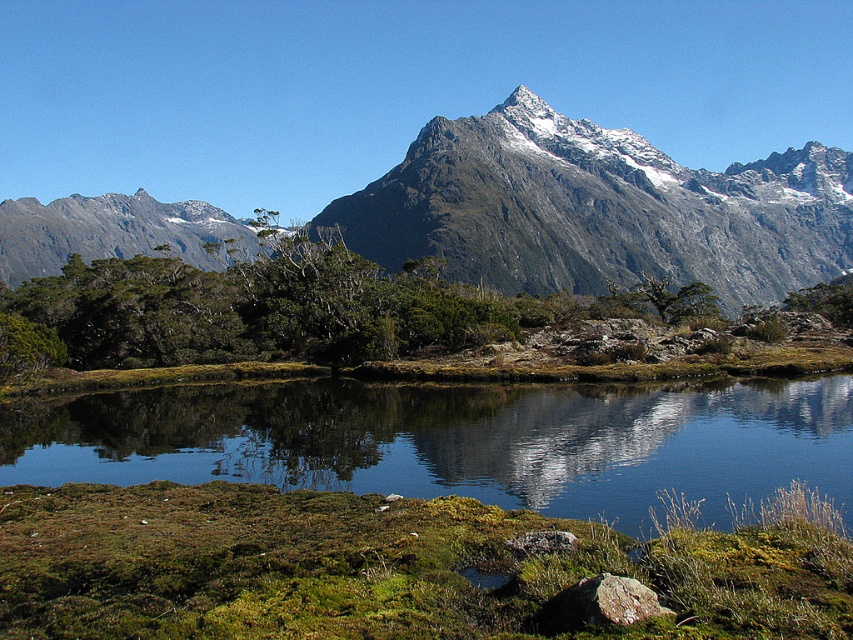
Question: Is green leafy shrub at center bigger than gray rocky mountain at upper left?

Choices:
 (A) no
 (B) yes

Answer: (A)

Question: Which point is farther from the camera taking this photo?

Choices:
 (A) (15, 284)
 (B) (703, 317)
 (C) (28, 259)
 (D) (811, 403)

Answer: (C)

Question: Does green leafy shrub at center appear on the right side of gray rocky mountain at upper left?

Choices:
 (A) yes
 (B) no

Answer: (A)

Question: Estimate the real-world distances between objects in this image. Which object is closer to the clear water at center?

Choices:
 (A) rugged granite mountain range at upper center
 (B) green leafy shrub at center

Answer: (B)

Question: Is green leafy shrub at center bigger than gray rocky mountain at upper left?

Choices:
 (A) no
 (B) yes

Answer: (A)

Question: Considering the real-world distances, which object is closest to the rugged granite mountain range at upper center?

Choices:
 (A) clear water at center
 (B) gray rocky mountain at upper left

Answer: (B)